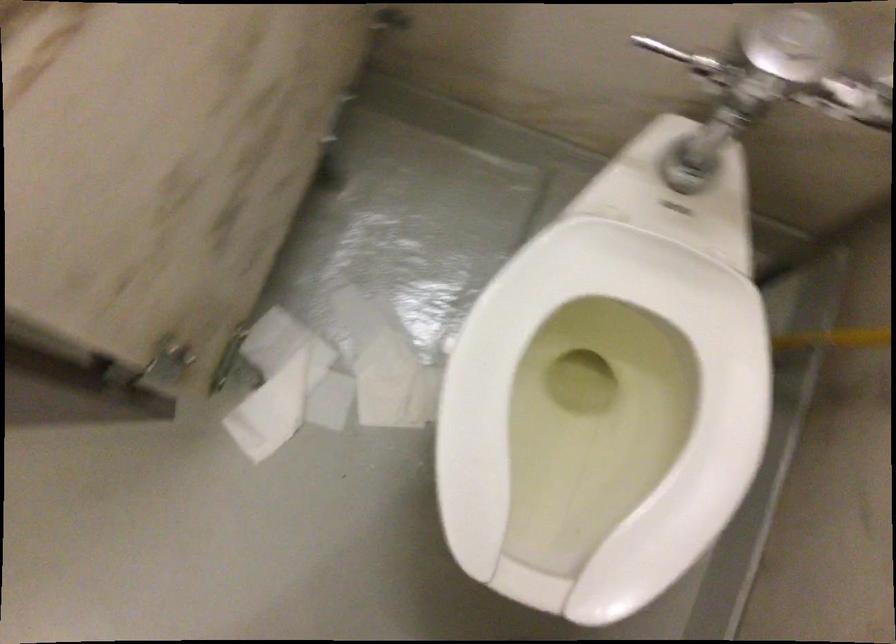
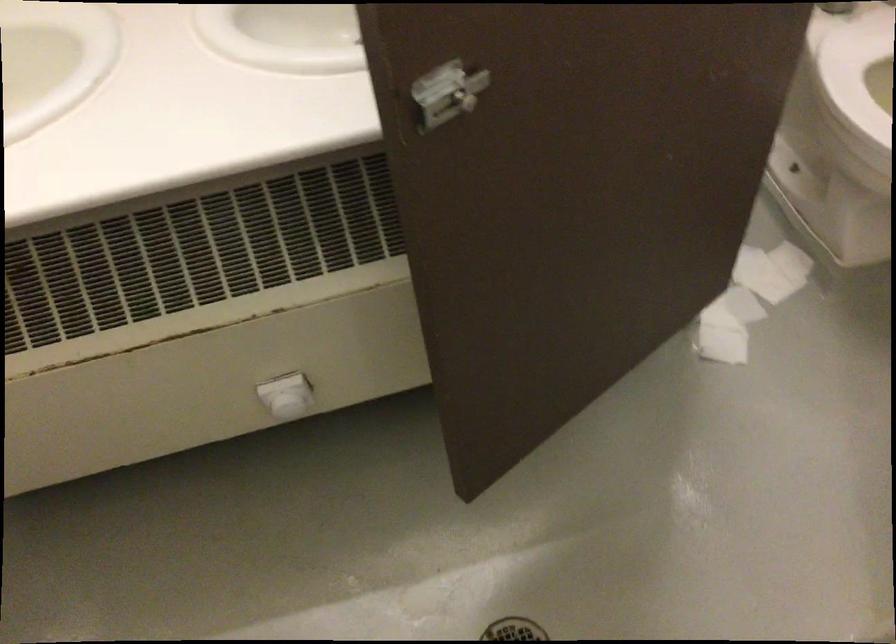
Where in the second image is the point corresponding to [222,450] from the first image?

(721, 344)